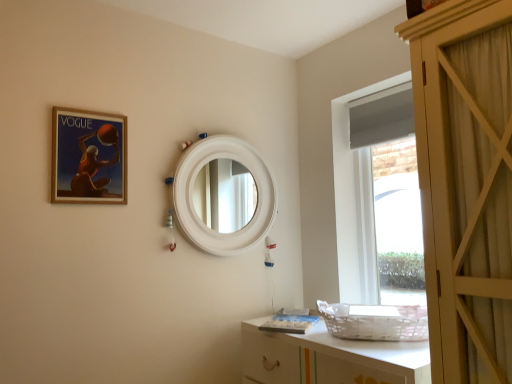
Where is `matte wooden picture frame at upper left`? matte wooden picture frame at upper left is located at coordinates (88, 157).

Choose the correct answer: Is white glossy cabinet at lower right inside white matte mirror at center or outside it?

white glossy cabinet at lower right is located beyond the bounds of white matte mirror at center.

Is white glossy cabinet at lower right taller or shorter than white matte mirror at center?

In the image, white glossy cabinet at lower right appears to be shorter than white matte mirror at center.

Is the position of white glossy cabinet at lower right more distant than that of white matte mirror at center?

No, it is not.

Is point (305, 353) positioned in front of point (190, 224)?

Yes, point (305, 353) is closer to viewer.

You are a GUI agent. You are given a task and a screenshot of the screen. Output one action in this format:
    pyautogui.click(x=<x>, y=<y>)
    Task: Click on the picture frame to the left of white matte mirror at center
    
    Given the screenshot: What is the action you would take?
    pyautogui.click(x=88, y=157)

From a real-world perspective, relative to white matte mirror at center, is matte wooden picture frame at upper left vertically above or below?

From a real-world perspective, matte wooden picture frame at upper left is physically above white matte mirror at center.

Is point (125, 150) positioned in front of point (204, 240)?

Yes, point (125, 150) is in front of point (204, 240).

Can white matte mirror at center be found inside matte wooden picture frame at upper left?

That's incorrect, white matte mirror at center is not inside matte wooden picture frame at upper left.

From a real-world perspective, is white matte mirror at center physically located above or below matte wooden picture frame at upper left?

white matte mirror at center is below matte wooden picture frame at upper left.

How many degrees apart are the facing directions of white matte mirror at center and matte wooden picture frame at upper left?

0.141 degrees.

At what (x,y) coordinates should I click in order to perform the action: click on picture frame that is above the white matte mirror at center (from the image's perspective). Please return your answer as a coordinate pair (x, y). This screenshot has width=512, height=384. Looking at the image, I should click on (88, 157).

Is white matte mirror at center positioned before matte wooden picture frame at upper left?

No, it is not.

Is white matte mirror at center taller than white glossy cabinet at lower right?

Indeed, white matte mirror at center has a greater height compared to white glossy cabinet at lower right.

From a real-world perspective, is white matte mirror at center beneath white glossy cabinet at lower right?

Incorrect, from a real-world perspective, white matte mirror at center is higher than white glossy cabinet at lower right.

From the image's perspective, between white matte mirror at center and white glossy cabinet at lower right, who is located below?

white glossy cabinet at lower right is shown below in the image.

From the picture: Considering the sizes of objects matte wooden picture frame at upper left and white glossy cabinet at lower right in the image provided, who is bigger, matte wooden picture frame at upper left or white glossy cabinet at lower right?

Bigger between the two is white glossy cabinet at lower right.

Are matte wooden picture frame at upper left and white glossy cabinet at lower right far apart?

Yes, matte wooden picture frame at upper left and white glossy cabinet at lower right are quite far apart.

Is matte wooden picture frame at upper left positioned behind white glossy cabinet at lower right?

That is True.

Considering the relative sizes of white glossy cabinet at lower right and matte wooden picture frame at upper left in the image provided, is white glossy cabinet at lower right smaller than matte wooden picture frame at upper left?

No.

Does white glossy cabinet at lower right turn towards matte wooden picture frame at upper left?

No, white glossy cabinet at lower right does not turn towards matte wooden picture frame at upper left.

Is white glossy cabinet at lower right inside the boundaries of matte wooden picture frame at upper left, or outside?

white glossy cabinet at lower right is not enclosed by matte wooden picture frame at upper left.

Considering the sizes of objects white glossy cabinet at lower right and matte wooden picture frame at upper left in the image provided, who is thinner, white glossy cabinet at lower right or matte wooden picture frame at upper left?

With smaller width is matte wooden picture frame at upper left.

Where is `mirror above the white glossy cabinet at lower right (from a real-world perspective)`? mirror above the white glossy cabinet at lower right (from a real-world perspective) is located at coordinates (192, 200).

Where is `mirror on the right of matte wooden picture frame at upper left`? This screenshot has width=512, height=384. mirror on the right of matte wooden picture frame at upper left is located at coordinates (192, 200).

When comparing their distances from white glossy cabinet at lower right, does white matte mirror at center or matte wooden picture frame at upper left seem closer?

The object closer to white glossy cabinet at lower right is white matte mirror at center.

Which object lies further to the anchor point white matte mirror at center, matte wooden picture frame at upper left or white glossy cabinet at lower right?

white glossy cabinet at lower right is further to white matte mirror at center.

Which object lies further to the anchor point white matte mirror at center, white glossy cabinet at lower right or matte wooden picture frame at upper left?

white glossy cabinet at lower right lies further to white matte mirror at center than the other object.

Considering their positions, is matte wooden picture frame at upper left positioned closer to white glossy cabinet at lower right than white matte mirror at center?

white matte mirror at center lies closer to white glossy cabinet at lower right than the other object.

Considering their positions, is white glossy cabinet at lower right positioned further to matte wooden picture frame at upper left than white matte mirror at center?

The object further to matte wooden picture frame at upper left is white glossy cabinet at lower right.

Considering their positions, is white matte mirror at center positioned further to matte wooden picture frame at upper left than white glossy cabinet at lower right?

Among the two, white glossy cabinet at lower right is located further to matte wooden picture frame at upper left.

Identify the location of mirror located between matte wooden picture frame at upper left and white glossy cabinet at lower right in the left-right direction. (192, 200).